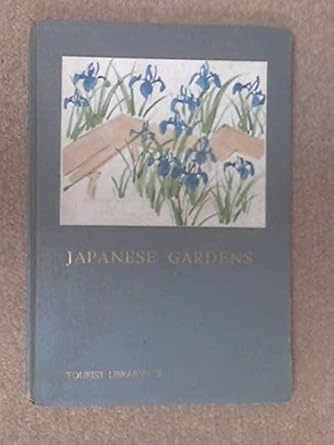
I want to click on cover, so click(141, 314).